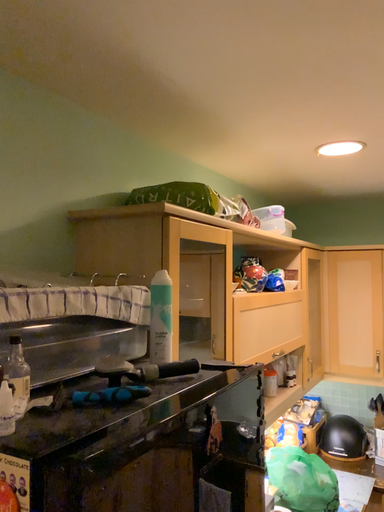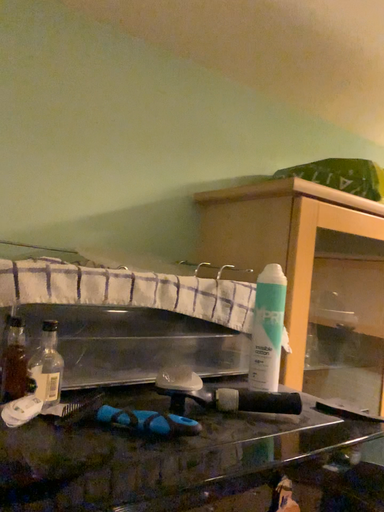
Question: How did the camera likely rotate when shooting the video?

Choices:
 (A) rotated left
 (B) rotated right

Answer: (A)